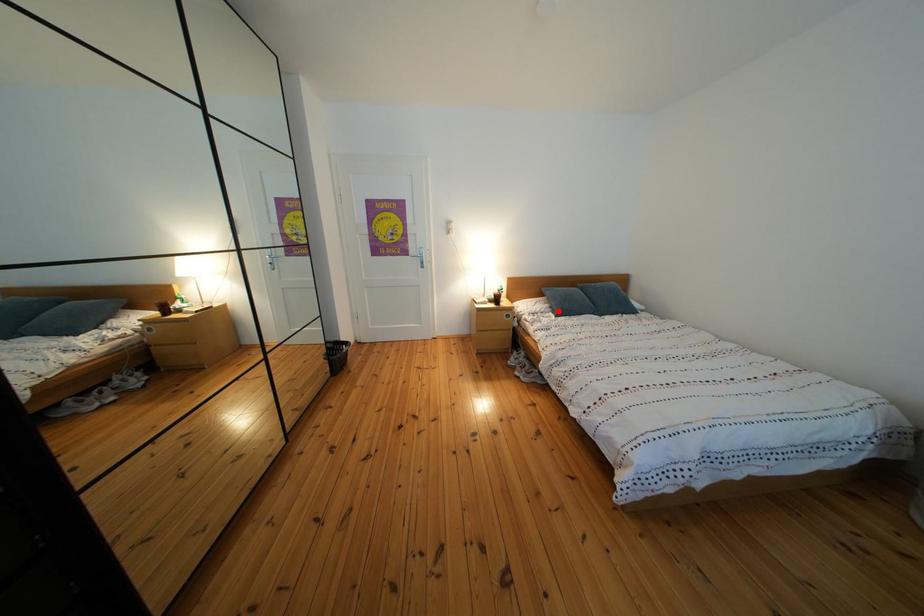
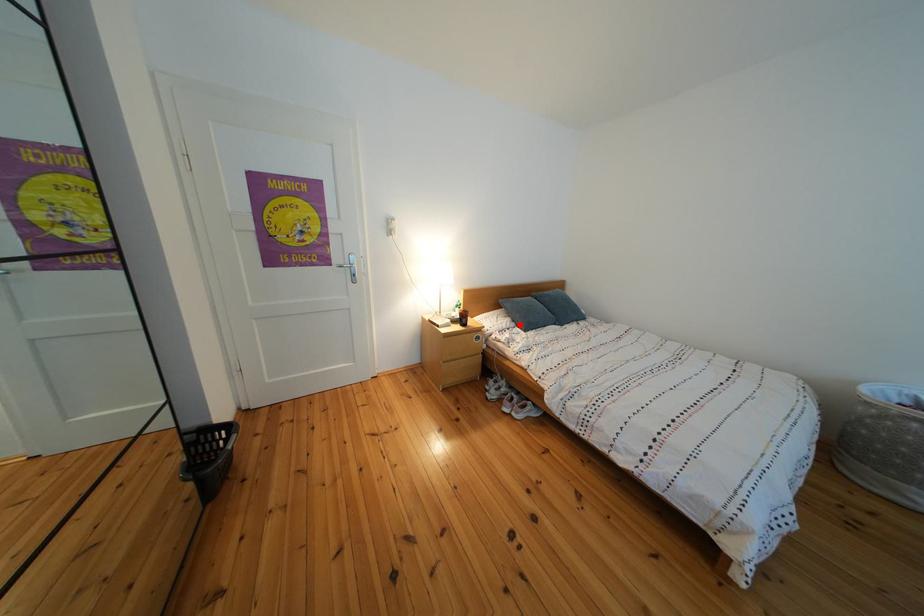
I am providing you with two images of the same scene from different viewpoints. A red point is marked on the first image and another point is marked on the second image. Is the red point in image1 aligned with the point shown in image2?

Yes